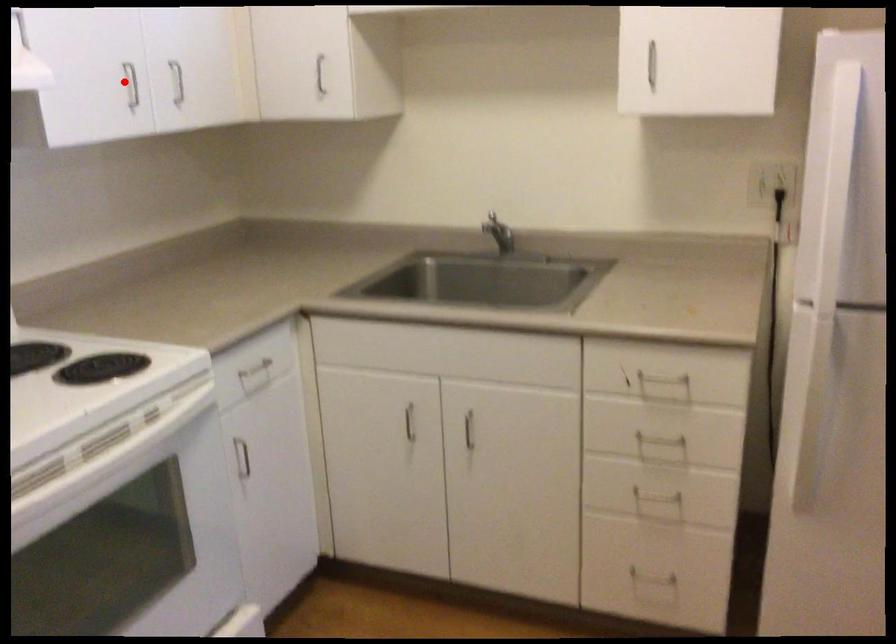
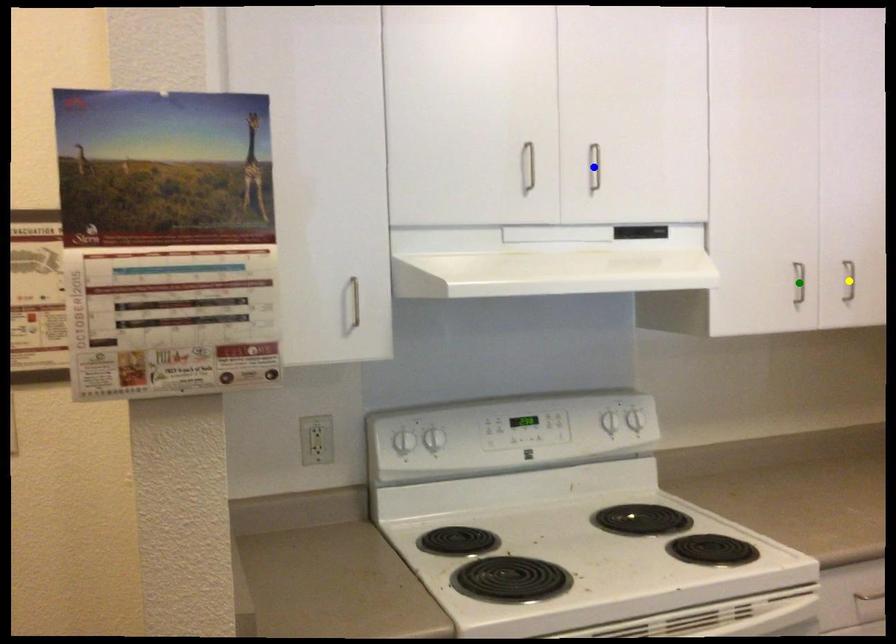
Question: I am providing you with two images of the same scene from different viewpoints. A red point is marked on the first image. You are given multiple points on the second image. Which spot in image 2 lines up with the point in image 1?

Choices:
 (A) green point
 (B) yellow point
 (C) blue point

Answer: (A)